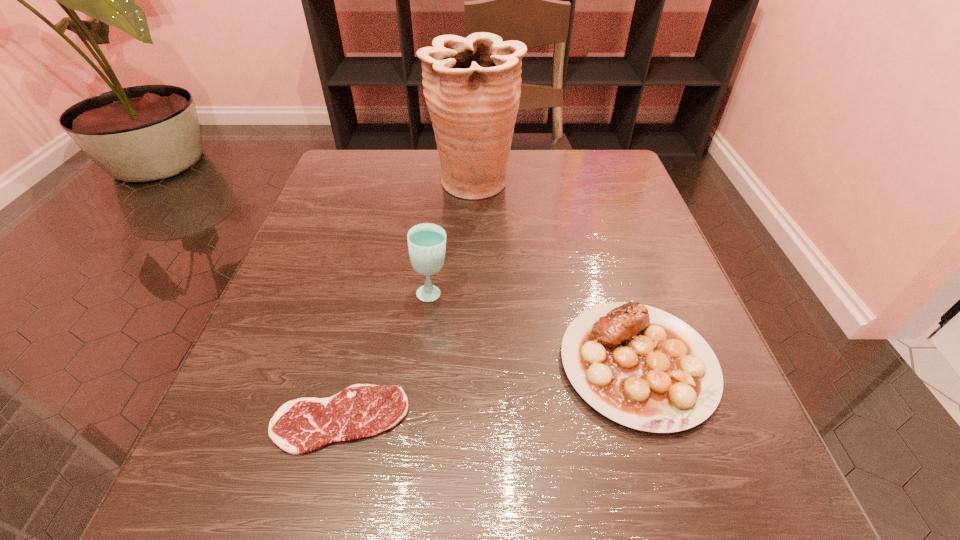
At what (x,y) coordinates should I click in order to perform the action: click on vacant area between the tallest object and the shortest object. Please return your answer as a coordinate pair (x, y). This screenshot has width=960, height=540. Looking at the image, I should click on click(407, 301).

In order to click on unoccupied area between the second shortest object and the shorter steak in this screenshot , I will do `click(489, 392)`.

The height and width of the screenshot is (540, 960). Find the location of `free spot between the farthest object and the right steak`. free spot between the farthest object and the right steak is located at coordinates [556, 274].

Find the location of a particular element. vacant space that's between the shorter steak and the third nearest object is located at coordinates coord(386,356).

You are a GUI agent. You are given a task and a screenshot of the screen. Output one action in this format:
    pyautogui.click(x=<x>, y=<y>)
    Task: Click on the vacant space that is in between the shortest object and the second farthest object
    The height and width of the screenshot is (540, 960).
    Given the screenshot: What is the action you would take?
    pyautogui.click(x=386, y=356)

Where is `object that stands as the closest to the left steak`? This screenshot has height=540, width=960. object that stands as the closest to the left steak is located at coordinates (426, 242).

Choose which object is the second nearest neighbor to the taller steak. Please provide its 2D coordinates. Your answer should be formatted as a tuple, i.e. [(x, y)], where the tuple contains the x and y coordinates of a point satisfying the conditions above.

[(299, 426)]

Where is `free space that satisfies the following two spatial constraints: 1. on the back side of the right steak; 2. on the left side of the left steak`? free space that satisfies the following two spatial constraints: 1. on the back side of the right steak; 2. on the left side of the left steak is located at coordinates (354, 364).

At what (x,y) coordinates should I click in order to perform the action: click on vacant area in the image that satisfies the following two spatial constraints: 1. on the back side of the third nearest object; 2. on the left side of the tallest object. Please return your answer as a coordinate pair (x, y). Looking at the image, I should click on (444, 183).

At what (x,y) coordinates should I click in order to perform the action: click on free space that satisfies the following two spatial constraints: 1. on the back side of the left steak; 2. on the right side of the taller steak. Please return your answer as a coordinate pair (x, y). This screenshot has width=960, height=540. Looking at the image, I should click on [354, 364].